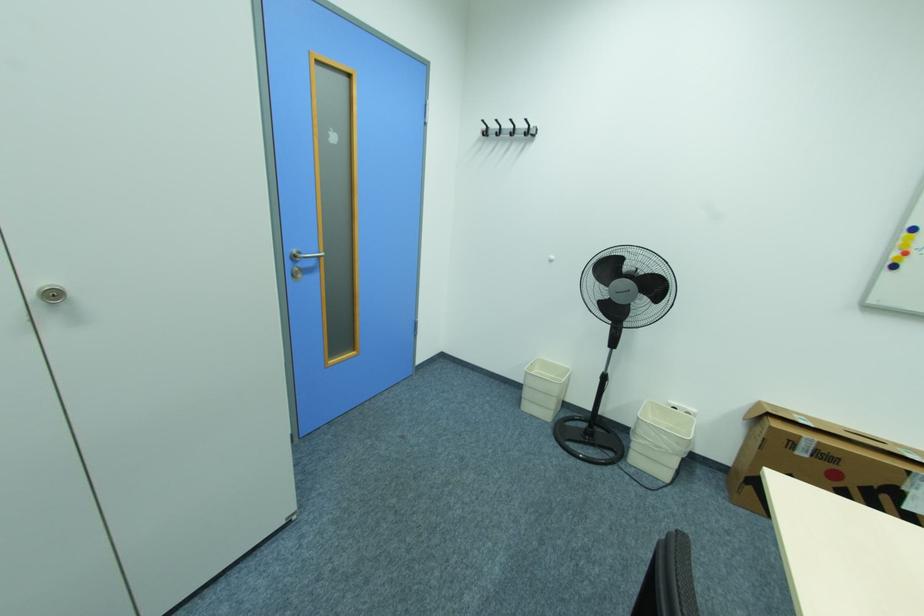
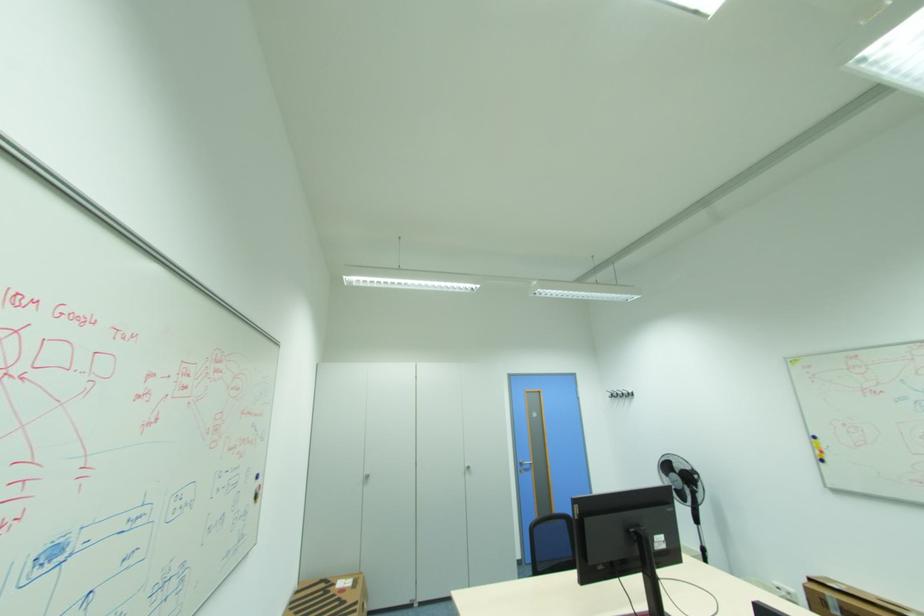
Locate, in the second image, the point that corresponds to the point at 489,120 in the first image.

(613, 391)